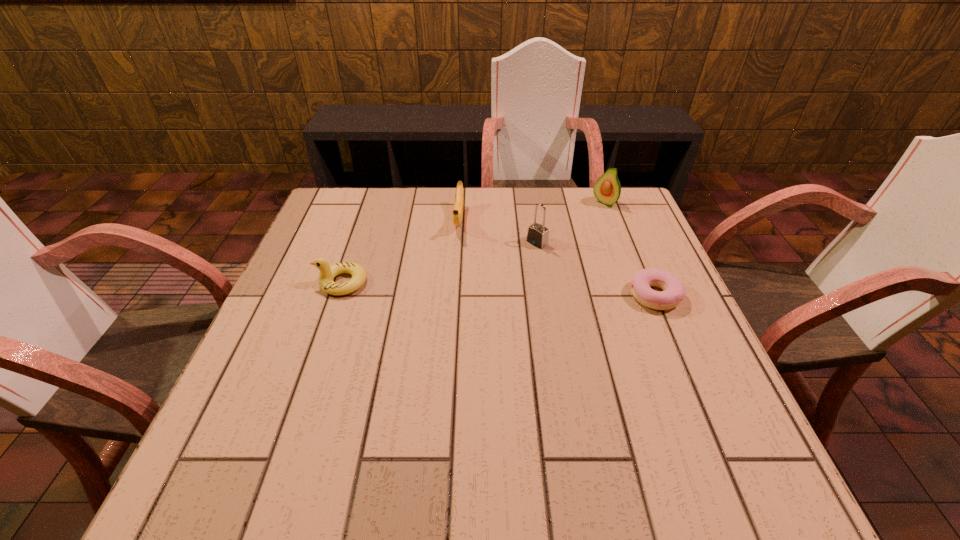
Image resolution: width=960 pixels, height=540 pixels. I want to click on vacant spot on the desktop that is between the duckling and the shortest object and is positioned on the cut side of the avocado, so click(513, 289).

Where is `free space on the desktop that is between the duckling and the shortest object and is positioned on the shackle of the padlock`? The width and height of the screenshot is (960, 540). free space on the desktop that is between the duckling and the shortest object and is positioned on the shackle of the padlock is located at coordinates (475, 288).

Find the location of `free space on the desktop that is between the duckling and the doughnut and is positioned at the stem of the banana`. free space on the desktop that is between the duckling and the doughnut and is positioned at the stem of the banana is located at coordinates (451, 287).